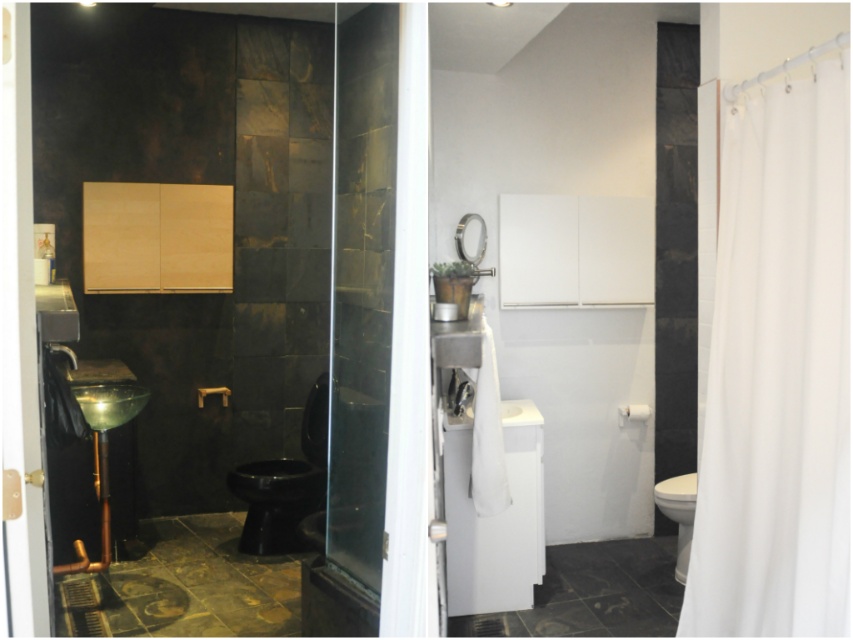
Does green glass bowl at left appear under white glossy toilet bowl at lower right?

Incorrect, green glass bowl at left is not positioned below white glossy toilet bowl at lower right.

Looking at this image, between green glass bowl at left and white glossy toilet bowl at lower right, which one appears on the right side from the viewer's perspective?

white glossy toilet bowl at lower right

Is point (85, 394) farther from viewer compared to point (688, 522)?

No, (85, 394) is in front of (688, 522).

The height and width of the screenshot is (640, 853). I want to click on green glass bowl at left, so click(109, 403).

Does transparent glass screen door at center have a smaller size compared to white glossy toilet bowl at lower right?

Actually, transparent glass screen door at center might be larger than white glossy toilet bowl at lower right.

Between transparent glass screen door at center and white glossy toilet bowl at lower right, which one is positioned lower?

white glossy toilet bowl at lower right

I want to click on transparent glass screen door at center, so click(361, 289).

Is white fabric shower curtain at right above white glossy toilet bowl at lower right?

Correct, white fabric shower curtain at right is located above white glossy toilet bowl at lower right.

Is point (798, 404) more distant than point (686, 481)?

No.

Find the location of `white fabric shower curtain at right`. white fabric shower curtain at right is located at coordinates (776, 372).